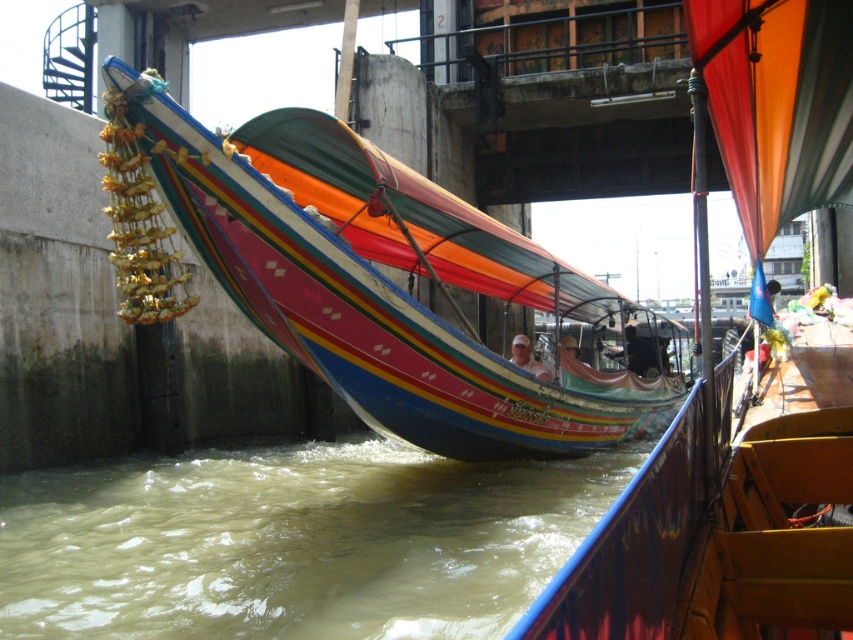
Consider the image. Does brown murky water at lower left have a greater width compared to multicolored fabric boat at center?

Correct, the width of brown murky water at lower left exceeds that of multicolored fabric boat at center.

This screenshot has height=640, width=853. What are the coordinates of `brown murky water at lower left` in the screenshot? It's located at (293, 541).